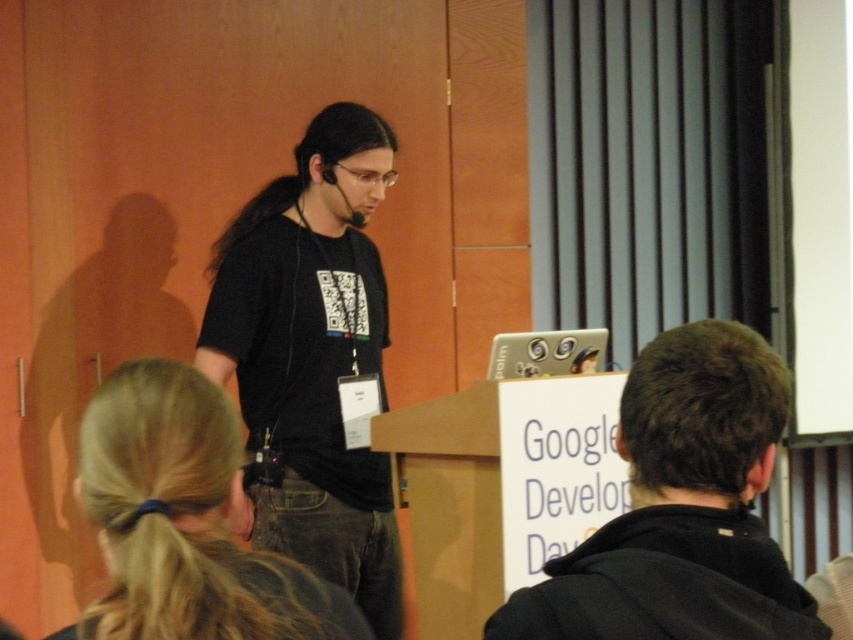
You are an attendee at the Google Developer Day event. You notice two items in the image related to the speaker. The first is the black matte jacket at center, and the second is the blonde hair at upper left. Which of these items is positioned higher in the image?

The black matte jacket at center is located above blonde hair at upper left, so the black matte jacket at center is positioned higher in the image.